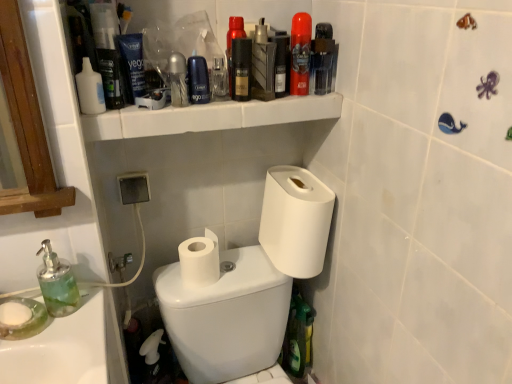
Question: Does matte black bottle at center, positioned as the fifth mouthwash in right-to-left order, appear on the left side of blue matte tube at upper center, the second mouthwash in the left-to-right sequence?

Choices:
 (A) no
 (B) yes

Answer: (A)

Question: From the image's perspective, is matte black bottle at center, acting as the fifth mouthwash starting from the left, under blue matte tube at upper center, the second mouthwash in the left-to-right sequence?

Choices:
 (A) no
 (B) yes

Answer: (B)

Question: From the image's perspective, is matte black bottle at center, acting as the fifth mouthwash starting from the left, above blue matte tube at upper center, the second mouthwash in the left-to-right sequence?

Choices:
 (A) no
 (B) yes

Answer: (A)

Question: Would you consider matte black bottle at center, acting as the fifth mouthwash starting from the left, to be distant from blue matte tube at upper center, which is the 8th mouthwash in right-to-left order?

Choices:
 (A) yes
 (B) no

Answer: (B)

Question: Is matte black bottle at center, positioned as the fifth mouthwash in right-to-left order, oriented away from blue matte tube at upper center, which is the 8th mouthwash in right-to-left order?

Choices:
 (A) yes
 (B) no

Answer: (B)

Question: Considering the positions of metallic silver mouthwash at upper center, which appears as the third mouthwash when viewed from the left, and black matte bottle at upper center, which appears as the 3th mouthwash when viewed from the right, in the image, is metallic silver mouthwash at upper center, which appears as the third mouthwash when viewed from the left, taller or shorter than black matte bottle at upper center, which appears as the 3th mouthwash when viewed from the right,?

Choices:
 (A) short
 (B) tall

Answer: (A)

Question: Looking at the image, does metallic silver mouthwash at upper center, which appears as the third mouthwash when viewed from the left, seem bigger or smaller compared to black matte bottle at upper center, which appears as the 3th mouthwash when viewed from the right?

Choices:
 (A) small
 (B) big

Answer: (B)

Question: From the image's perspective, relative to black matte bottle at upper center, which appears as the 3th mouthwash when viewed from the right, is metallic silver mouthwash at upper center, which appears as the third mouthwash when viewed from the left, above or below?

Choices:
 (A) above
 (B) below

Answer: (B)

Question: Do you think metallic silver mouthwash at upper center, which appears as the third mouthwash when viewed from the left, is within black matte bottle at upper center, which appears as the 3th mouthwash when viewed from the right, or outside of it?

Choices:
 (A) inside
 (B) outside

Answer: (B)

Question: Is matte black bottle at center, positioned as the fifth mouthwash in right-to-left order, to the left or to the right of metallic silver mouthwash at upper center, the 7th mouthwash viewed from the right, in the image?

Choices:
 (A) left
 (B) right

Answer: (B)

Question: Considering the positions of matte black bottle at center, positioned as the fifth mouthwash in right-to-left order, and metallic silver mouthwash at upper center, which appears as the third mouthwash when viewed from the left, in the image, is matte black bottle at center, positioned as the fifth mouthwash in right-to-left order, taller or shorter than metallic silver mouthwash at upper center, which appears as the third mouthwash when viewed from the left,?

Choices:
 (A) short
 (B) tall

Answer: (B)

Question: Considering the positions of point (245, 79) and point (169, 82), is point (245, 79) closer or farther from the camera than point (169, 82)?

Choices:
 (A) farther
 (B) closer

Answer: (B)

Question: Is matte black bottle at center, positioned as the fifth mouthwash in right-to-left order, inside or outside of metallic silver mouthwash at upper center, which appears as the third mouthwash when viewed from the left?

Choices:
 (A) outside
 (B) inside

Answer: (A)

Question: Considering the positions of matte blue shaving cream canister at upper center and transparent plastic mouthwash at upper right, positioned as the 1th mouthwash in right-to-left order, in the image, is matte blue shaving cream canister at upper center taller or shorter than transparent plastic mouthwash at upper right, positioned as the 1th mouthwash in right-to-left order,?

Choices:
 (A) tall
 (B) short

Answer: (B)

Question: Is matte blue shaving cream canister at upper center to the left or to the right of transparent plastic mouthwash at upper right, the 9th mouthwash when ordered from left to right, in the image?

Choices:
 (A) right
 (B) left

Answer: (B)